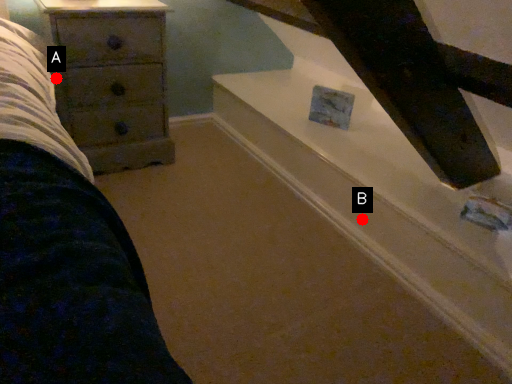
Question: Two points are circled on the image, labeled by A and B beside each circle. Which point appears closest to the camera in this image?

Choices:
 (A) A is closer
 (B) B is closer

Answer: (B)